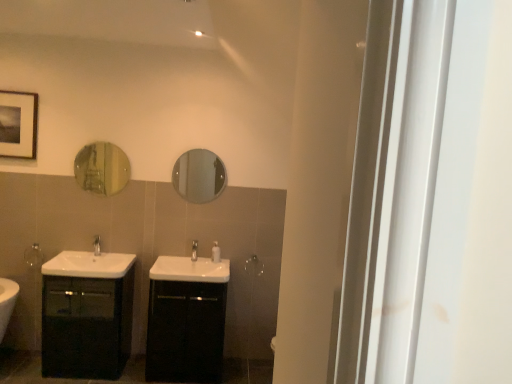
Find the location of a particular element. The height and width of the screenshot is (384, 512). gold reflective mirror at upper left, acting as the 1th mirror starting from the left is located at coordinates (102, 168).

Image resolution: width=512 pixels, height=384 pixels. What are the coordinates of `silver metallic towel bar at center, the 2th towel bar when ordered from left to right` in the screenshot? It's located at (254, 264).

In order to face black glossy cabinet at center, which is the second bathroom cabinet from left to right, should I rotate leftwards or rightwards?

Rotate your view left by about 9.009°.

Locate an element on the screen. This screenshot has width=512, height=384. clear glass mirror at center, placed as the second mirror when sorted from left to right is located at coordinates (199, 176).

Where is `gold reflective mirror at upper left, acting as the 1th mirror starting from the left`? gold reflective mirror at upper left, acting as the 1th mirror starting from the left is located at coordinates (102, 168).

Between gold reflective mirror at upper left, acting as the 1th mirror starting from the left, and satin nickel faucet at center, placed as the first tap when sorted from right to left, which one has smaller size?

satin nickel faucet at center, placed as the first tap when sorted from right to left.

Is satin nickel faucet at center, placed as the first tap when sorted from right to left, located within gold reflective mirror at upper left, the second mirror positioned from the right?

Definitely not — satin nickel faucet at center, placed as the first tap when sorted from right to left, is not inside gold reflective mirror at upper left, the second mirror positioned from the right.

How much distance is there between gold reflective mirror at upper left, the second mirror positioned from the right, and satin nickel faucet at center, placed as the first tap when sorted from right to left?

gold reflective mirror at upper left, the second mirror positioned from the right, is 94.26 centimeters away from satin nickel faucet at center, placed as the first tap when sorted from right to left.

Is black glossy cabinet at center, the first bathroom cabinet from the right, outside of white glossy sink at center, the first sink viewed from the right?

Absolutely, black glossy cabinet at center, the first bathroom cabinet from the right, is external to white glossy sink at center, the first sink viewed from the right.

From the image's perspective, which object appears higher, black glossy cabinet at center, the first bathroom cabinet from the right, or white glossy sink at center, the first sink viewed from the right?

white glossy sink at center, the first sink viewed from the right, from the image's perspective.

Does black glossy cabinet at center, which is the second bathroom cabinet from left to right, appear on the right side of white glossy sink at center, the first sink viewed from the right?

No, black glossy cabinet at center, which is the second bathroom cabinet from left to right, is not to the right of white glossy sink at center, the first sink viewed from the right.

At what (x,y) coordinates should I click in order to perform the action: click on towel bar on the right of satin nickel faucet at center, placed as the first tap when sorted from right to left. Please return your answer as a coordinate pair (x, y). The height and width of the screenshot is (384, 512). Looking at the image, I should click on (254, 264).

Is point (195, 243) closer to viewer compared to point (256, 261)?

Yes, it is.

Between satin nickel faucet at center, placed as the first tap when sorted from right to left, and silver metallic towel bar at center, which ranks as the first towel bar in back-to-front order, which one appears on the left side from the viewer's perspective?

satin nickel faucet at center, placed as the first tap when sorted from right to left.

What's the angular difference between white glossy soap dispenser at center and clear glass mirror at center, the 1th mirror positioned from the right,'s facing directions?

The angle between the facing direction of white glossy soap dispenser at center and the facing direction of clear glass mirror at center, the 1th mirror positioned from the right, is 0.342 degrees.

From the picture: Which is less distant, (x=215, y=260) or (x=202, y=152)?

Point (x=215, y=260) appears to be closer to the viewer than point (x=202, y=152).

There is a white glossy soap dispenser at center. Identify the location of the 1st mirror above it (from the image's perspective). (199, 176).

Who is shorter, white glossy soap dispenser at center or clear glass mirror at center, placed as the second mirror when sorted from left to right?

With less height is white glossy soap dispenser at center.

From the image's perspective, between gold reflective mirror at upper left, the second mirror positioned from the right, and matte black picture frame at upper left, which one is located above?

From the image's view, matte black picture frame at upper left is above.

Are gold reflective mirror at upper left, the second mirror positioned from the right, and matte black picture frame at upper left located far from each other?

gold reflective mirror at upper left, the second mirror positioned from the right, is near matte black picture frame at upper left, not far away.

Is gold reflective mirror at upper left, acting as the 1th mirror starting from the left, thinner than matte black picture frame at upper left?

Indeed, gold reflective mirror at upper left, acting as the 1th mirror starting from the left, has a lesser width compared to matte black picture frame at upper left.

Could you tell me if gold reflective mirror at upper left, acting as the 1th mirror starting from the left, is facing matte black picture frame at upper left?

No, gold reflective mirror at upper left, acting as the 1th mirror starting from the left, is not aimed at matte black picture frame at upper left.

In the scene shown: Who is smaller, silver metallic tap at center, which is the first tap in left-to-right order, or black glossy cabinet at center, the first bathroom cabinet from the right?

Smaller between the two is silver metallic tap at center, which is the first tap in left-to-right order.

From a real-world perspective, is silver metallic tap at center, which is the first tap in left-to-right order, located beneath black glossy cabinet at center, the first bathroom cabinet from the right?

Incorrect, from a real-world perspective, silver metallic tap at center, which is the first tap in left-to-right order, is higher than black glossy cabinet at center, the first bathroom cabinet from the right.

Based on the photo, in terms of width, does silver metallic tap at center, which is the 2th tap from right to left, look wider or thinner when compared to black glossy cabinet at center, the first bathroom cabinet from the right?

In the image, silver metallic tap at center, which is the 2th tap from right to left, appears to be more narrow than black glossy cabinet at center, the first bathroom cabinet from the right.

Is silver metallic tap at center, which is the 2th tap from right to left, at the left side of black glossy cabinet at center, the first bathroom cabinet from the right?

Yes.

In the scene shown: Which object is thinner, satin nickel faucet at center, placed as the first tap when sorted from right to left, or matte black cabinet at left, the 1th bathroom cabinet positioned from the left?

Thinner between the two is satin nickel faucet at center, placed as the first tap when sorted from right to left.

How far apart are satin nickel faucet at center, which ranks as the 2th tap in left-to-right order, and matte black cabinet at left, marked as the second bathroom cabinet in a right-to-left arrangement?

satin nickel faucet at center, which ranks as the 2th tap in left-to-right order, is 36.95 inches away from matte black cabinet at left, marked as the second bathroom cabinet in a right-to-left arrangement.

In the scene shown: Is satin nickel faucet at center, placed as the first tap when sorted from right to left, outside of matte black cabinet at left, marked as the second bathroom cabinet in a right-to-left arrangement?

Yes, satin nickel faucet at center, placed as the first tap when sorted from right to left, is outside of matte black cabinet at left, marked as the second bathroom cabinet in a right-to-left arrangement.

Considering the sizes of objects satin nickel faucet at center, which ranks as the 2th tap in left-to-right order, and matte black cabinet at left, marked as the second bathroom cabinet in a right-to-left arrangement, in the image provided, who is taller, satin nickel faucet at center, which ranks as the 2th tap in left-to-right order, or matte black cabinet at left, marked as the second bathroom cabinet in a right-to-left arrangement,?

matte black cabinet at left, marked as the second bathroom cabinet in a right-to-left arrangement, is taller.

From the gold reflective mirror at upper left, the second mirror positioned from the right, count 1st taps forward and point to it. Please provide its 2D coordinates.

[(194, 250)]

Identify the location of bathroom cabinet that is the 1st one below the white glossy sink at center, placed as the second sink when sorted from left to right (from a real-world perspective). (186, 319).

Estimate the real-world distances between objects in this image. Which object is further from white glossy sink at center, the first sink viewed from the right, silver metallic tap at center, which is the first tap in left-to-right order, or white glossy soap dispenser at center?

The object further to white glossy sink at center, the first sink viewed from the right, is silver metallic tap at center, which is the first tap in left-to-right order.

Estimate the real-world distances between objects in this image. Which object is further from silver metallic tap at center, which is the 2th tap from right to left, white glossy sink at center, placed as the second sink when sorted from left to right, or satin nickel faucet at center, placed as the first tap when sorted from right to left?

white glossy sink at center, placed as the second sink when sorted from left to right, is positioned further to the anchor silver metallic tap at center, which is the 2th tap from right to left.

Looking at the image, which one is located closer to matte black picture frame at upper left, white glossy soap dispenser at center or matte black cabinet at left, the 1th bathroom cabinet positioned from the left?

matte black cabinet at left, the 1th bathroom cabinet positioned from the left.

When comparing their distances from matte black picture frame at upper left, does white glossy sink at center, placed as the second sink when sorted from left to right, or black glossy cabinet at center, which is the second bathroom cabinet from left to right, seem further?

black glossy cabinet at center, which is the second bathroom cabinet from left to right, is positioned further to the anchor matte black picture frame at upper left.

When comparing their distances from white glossy sink at center, the first sink viewed from the right, does white glossy sink at lower left, placed as the 2th sink when sorted from right to left, or white glossy soap dispenser at center seem further?

The object further to white glossy sink at center, the first sink viewed from the right, is white glossy sink at lower left, placed as the 2th sink when sorted from right to left.

Looking at the image, which one is located closer to black glossy cabinet at center, the first bathroom cabinet from the right, silver metallic towel bar at center, which ranks as the first towel bar in back-to-front order, or white glossy soap dispenser at center?

Among the two, white glossy soap dispenser at center is located nearer to black glossy cabinet at center, the first bathroom cabinet from the right.

Consider the image. When comparing their distances from silver metallic tap at center, which is the 2th tap from right to left, does clear glass mirror at center, placed as the second mirror when sorted from left to right, or matte black picture frame at upper left seem further?

matte black picture frame at upper left is positioned further to the anchor silver metallic tap at center, which is the 2th tap from right to left.

Based on their spatial positions, is satin nickel faucet at center, placed as the first tap when sorted from right to left, or black glossy cabinet at center, which is the second bathroom cabinet from left to right, closer to gold reflective mirror at upper left, acting as the 1th mirror starting from the left?

satin nickel faucet at center, placed as the first tap when sorted from right to left.

I want to click on tap between silver metallic tap at center, which is the 2th tap from right to left, and clear glass mirror at center, the 1th mirror positioned from the right, so click(x=194, y=250).

Locate an element on the screen. bathroom cabinet located between silver metallic tap at center, which is the 2th tap from right to left, and white glossy soap dispenser at center in the left-right direction is located at coordinates (186, 319).

What are the coordinates of `toiletry between silver metallic towel bar at left, the second towel bar viewed from the right, and silver metallic towel bar at center, the second towel bar from the front` in the screenshot? It's located at [x=216, y=252].

Locate an element on the screen. The height and width of the screenshot is (384, 512). tap located between silver metallic towel bar at left, placed as the first towel bar when sorted from left to right, and satin nickel faucet at center, which ranks as the 2th tap in left-to-right order, in the left-right direction is located at coordinates (97, 245).